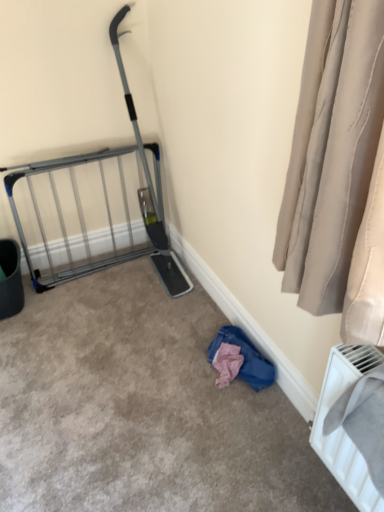
Image resolution: width=384 pixels, height=512 pixels. Describe the element at coordinates (245, 357) in the screenshot. I see `pink fabric at lower right` at that location.

Image resolution: width=384 pixels, height=512 pixels. What do you see at coordinates (78, 216) in the screenshot?
I see `silver metallic gate at left` at bounding box center [78, 216].

Identify the location of white plastic radiator at lower right. (342, 438).

Is pink fabric at lower right looking in the opposite direction of silver metallic gate at left?

No, pink fabric at lower right is not facing the opposite direction of silver metallic gate at left.

Is pink fabric at lower right beside silver metallic gate at left?

No, pink fabric at lower right is not making contact with silver metallic gate at left.

Which of these two, pink fabric at lower right or silver metallic gate at left, is thinner?

Thinner between the two is silver metallic gate at left.

Relative to silver metallic gate at left, is pink fabric at lower right in front or behind?

pink fabric at lower right is in front of silver metallic gate at left.

Is white plastic radiator at lower right oriented towards silver metallic gate at left?

No, white plastic radiator at lower right is not facing towards silver metallic gate at left.

From the image's perspective, is white plastic radiator at lower right on silver metallic gate at left?

No, from the image's perspective, white plastic radiator at lower right is not on top of silver metallic gate at left.

Which object is closer to the camera, white plastic radiator at lower right or silver metallic gate at left?

Positioned in front is white plastic radiator at lower right.

Is silver metallic gate at left further to the viewer compared to white plastic radiator at lower right?

Yes, it is behind white plastic radiator at lower right.

Considering the sizes of silver metallic gate at left and white plastic radiator at lower right in the image, is silver metallic gate at left taller or shorter than white plastic radiator at lower right?

In the image, silver metallic gate at left appears to be taller than white plastic radiator at lower right.

From the image's perspective, which is below, silver metallic gate at left or white plastic radiator at lower right?

white plastic radiator at lower right appears lower in the image.

Is silver metallic gate at left facing towards white plastic radiator at lower right?

Yes, silver metallic gate at left is facing white plastic radiator at lower right.

Is pink fabric at lower right at the back of silver metallic gate at left?

silver metallic gate at left does not have its back to pink fabric at lower right.

Measure the distance from silver metallic gate at left to pink fabric at lower right.

A distance of 1.01 meters exists between silver metallic gate at left and pink fabric at lower right.

Consider the image. Considering the relative positions of silver metallic gate at left and pink fabric at lower right in the image provided, is silver metallic gate at left to the left or to the right of pink fabric at lower right?

Based on their positions, silver metallic gate at left is located to the left of pink fabric at lower right.

From a real-world perspective, is silver metallic gate at left over pink fabric at lower right?

Yes.

Is point (349, 458) in front of point (256, 373)?

Yes, point (349, 458) is closer to viewer.

Is white plastic radiator at lower right bigger than pink fabric at lower right?

Yes.

From a real-world perspective, relative to pink fabric at lower right, is white plastic radiator at lower right vertically above or below?

white plastic radiator at lower right is above pink fabric at lower right.

Can you tell me how much white plastic radiator at lower right and pink fabric at lower right differ in facing direction?

white plastic radiator at lower right and pink fabric at lower right are facing 3.22 degrees away from each other.

Is pink fabric at lower right positioned before white plastic radiator at lower right?

No, it is behind white plastic radiator at lower right.

Considering the points (250, 352) and (323, 403), which point is behind, point (250, 352) or point (323, 403)?

Point (250, 352)

Is pink fabric at lower right bigger than white plastic radiator at lower right?

No.

Which object is positioned more to the right, pink fabric at lower right or white plastic radiator at lower right?

From the viewer's perspective, white plastic radiator at lower right appears more on the right side.

In the image, there is a silver metallic gate at left. Identify the location of clothing below it (from the image's perspective). The image size is (384, 512). (245, 357).

Where is `radiator that appears on the right of silver metallic gate at left`? The width and height of the screenshot is (384, 512). radiator that appears on the right of silver metallic gate at left is located at coordinates (342, 438).

When comparing their distances from white plastic radiator at lower right, does pink fabric at lower right or silver metallic gate at left seem further?

The object further to white plastic radiator at lower right is silver metallic gate at left.

Looking at the image, which one is located further to white plastic radiator at lower right, silver metallic gate at left or pink fabric at lower right?

silver metallic gate at left is further to white plastic radiator at lower right.

Considering their positions, is white plastic radiator at lower right positioned closer to silver metallic gate at left than pink fabric at lower right?

The object closer to silver metallic gate at left is pink fabric at lower right.

When comparing their distances from pink fabric at lower right, does silver metallic gate at left or white plastic radiator at lower right seem closer?

Based on the image, white plastic radiator at lower right appears to be nearer to pink fabric at lower right.

Considering their positions, is pink fabric at lower right positioned closer to silver metallic gate at left than white plastic radiator at lower right?

pink fabric at lower right is positioned closer to the anchor silver metallic gate at left.

Estimate the real-world distances between objects in this image. Which object is further from pink fabric at lower right, white plastic radiator at lower right or silver metallic gate at left?

Among the two, silver metallic gate at left is located further to pink fabric at lower right.

This screenshot has width=384, height=512. Identify the location of clothing positioned between white plastic radiator at lower right and silver metallic gate at left from near to far. (245, 357).